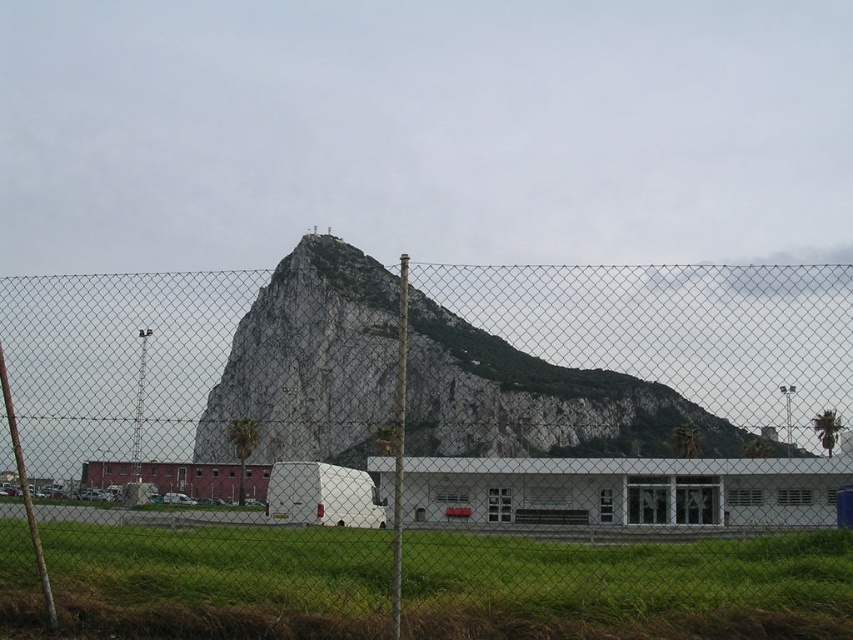
Question: From the image, what is the correct spatial relationship of metal chain-link fence at center in relation to rocky gray mountain at center?

Choices:
 (A) above
 (B) below

Answer: (B)

Question: Considering the relative positions of green grass at lower center and rocky gray mountain at center in the image provided, where is green grass at lower center located with respect to rocky gray mountain at center?

Choices:
 (A) left
 (B) right

Answer: (A)

Question: Among these objects, which one is farthest from the camera?

Choices:
 (A) metal chain-link fence at center
 (B) green grass at lower center
 (C) rocky gray mountain at center

Answer: (C)

Question: Which object appears closest to the camera in this image?

Choices:
 (A) metal chain-link fence at center
 (B) rocky gray mountain at center

Answer: (A)

Question: Is metal chain-link fence at center below green grass at lower center?

Choices:
 (A) yes
 (B) no

Answer: (B)

Question: Which point is closer to the camera?

Choices:
 (A) green grass at lower center
 (B) metal chain-link fence at center
 (C) rocky gray mountain at center

Answer: (A)